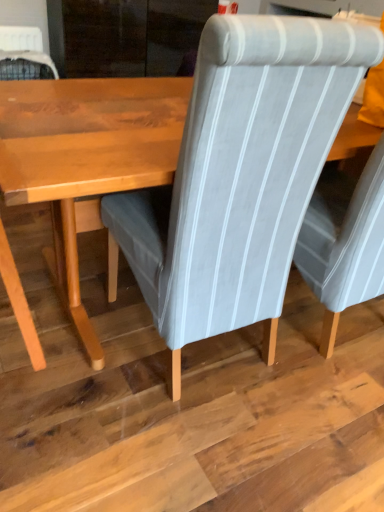
Find the location of a particular element. Image resolution: width=384 pixels, height=512 pixels. free space in front of light gray fabric chair at center is located at coordinates (167, 444).